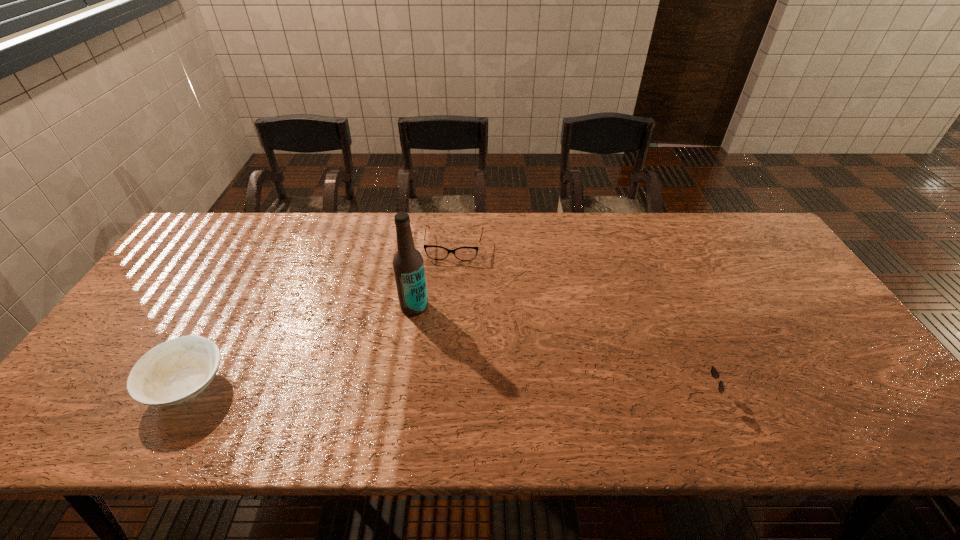
Identify the location of bowl. Image resolution: width=960 pixels, height=540 pixels. (173, 372).

In order to click on the rightmost object in this screenshot , I will do click(714, 372).

This screenshot has height=540, width=960. Find the location of `the shortest object`. the shortest object is located at coordinates (434, 252).

In order to click on the farthest object in this screenshot , I will do `click(434, 252)`.

Image resolution: width=960 pixels, height=540 pixels. I want to click on the second farthest object, so click(x=408, y=264).

Locate an element on the screen. beer bottle is located at coordinates (408, 264).

The height and width of the screenshot is (540, 960). In order to click on vacant space located 0.140m on the left of the bowl in this screenshot , I will do `click(90, 386)`.

Identify the location of free space located 0.150m in front of the lenses of the sunglasses. This screenshot has width=960, height=540. (778, 395).

Identify the location of vacant region located on the front-facing side of the farthest object. The height and width of the screenshot is (540, 960). (446, 296).

At what (x,y) coordinates should I click in order to perform the action: click on free space located on the front-facing side of the farthest object. Please return your answer as a coordinate pair (x, y). Looking at the image, I should click on (440, 340).